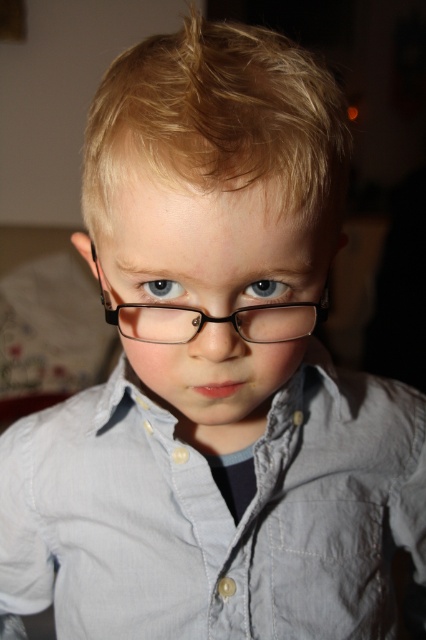
Question: Does blue matte eye at center appear under blue glossy eye at center?

Choices:
 (A) yes
 (B) no

Answer: (B)

Question: Which point appears farthest from the camera in this image?

Choices:
 (A) (169, 296)
 (B) (94, 616)
 (C) (267, 284)

Answer: (B)

Question: Does light blue cotton dress shirt at center appear over blue matte eye at center?

Choices:
 (A) no
 (B) yes

Answer: (A)

Question: Observing the image, what is the correct spatial positioning of blue matte eye at center in reference to blue glossy eye at center?

Choices:
 (A) left
 (B) right

Answer: (B)

Question: Which object appears closest to the camera in this image?

Choices:
 (A) blue glossy eye at center
 (B) light blue cotton dress shirt at center
 (C) blue matte eye at center

Answer: (A)

Question: Which point is farther from the camera taking this photo?

Choices:
 (A) (x=271, y=285)
 (B) (x=152, y=292)

Answer: (B)